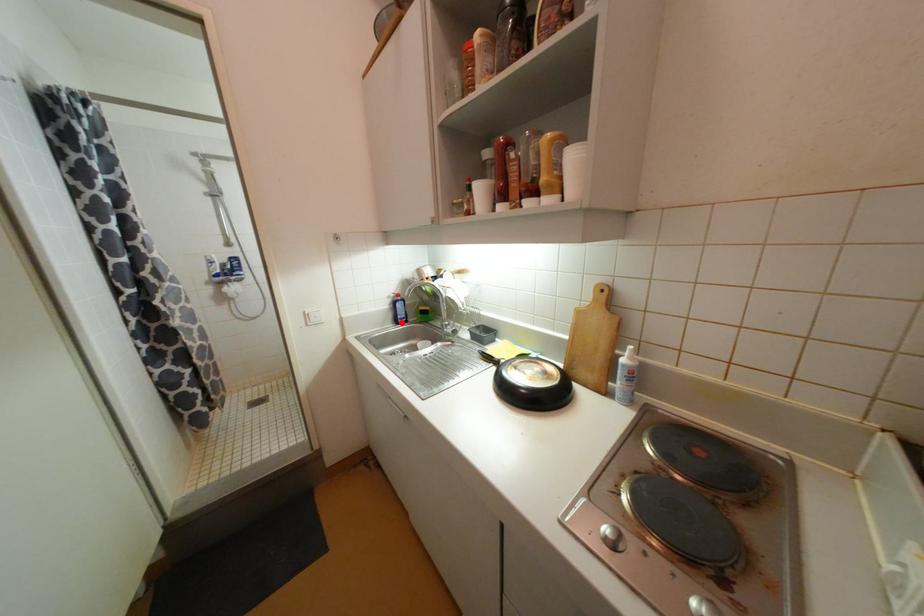
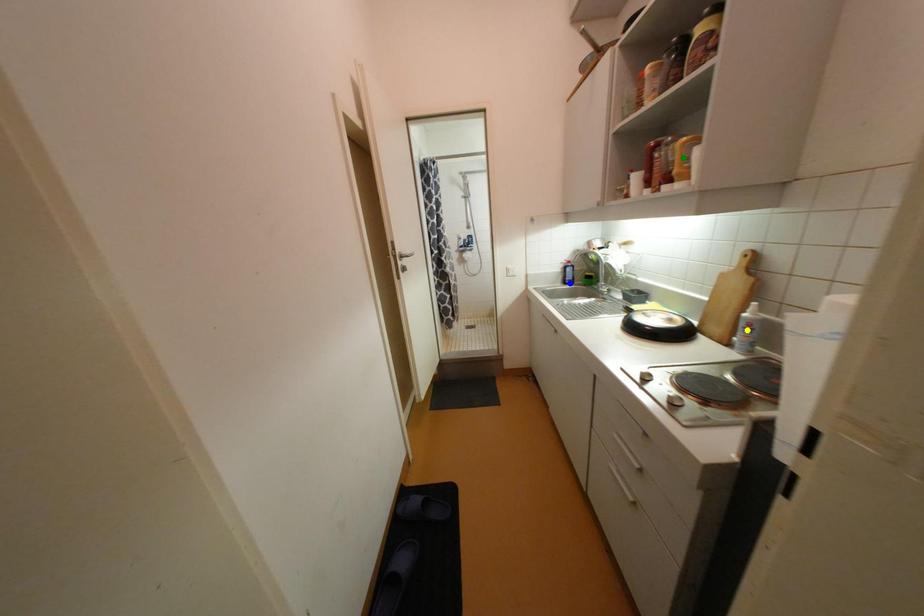
Question: I am providing you with two images of the same scene from different viewpoints. A red point is marked on the first image. You are given multiple points on the second image. Which spot in image 2 lines up with the point in image 1?

Choices:
 (A) blue point
 (B) green point
 (C) yellow point

Answer: (A)